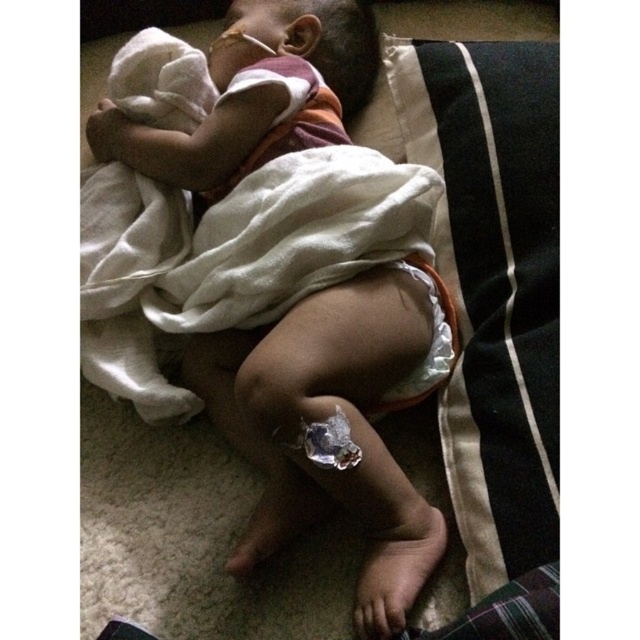
The height and width of the screenshot is (640, 640). I want to click on orange diaper at center, so coord(301,284).

Locate an element on the screen. orange diaper at center is located at coordinates (301, 284).

Measure the distance between point (552, 96) and camera.

The distance of point (552, 96) from camera is 34.87 inches.

Can you confirm if black fabric pillow at center is positioned to the right of white cloth diaper at lower center?

Indeed, black fabric pillow at center is positioned on the right side of white cloth diaper at lower center.

The height and width of the screenshot is (640, 640). I want to click on black fabric pillow at center, so click(490, 276).

Is the position of orange diaper at center less distant than that of black fabric pillow at center?

No, it is behind black fabric pillow at center.

From the picture: Between orange diaper at center and black fabric pillow at center, which one has less height?

Standing shorter between the two is black fabric pillow at center.

Which is in front, point (227, 243) or point (493, 378)?

Positioned in front is point (493, 378).

The image size is (640, 640). In order to click on orange diaper at center in this screenshot , I will do `click(301, 284)`.